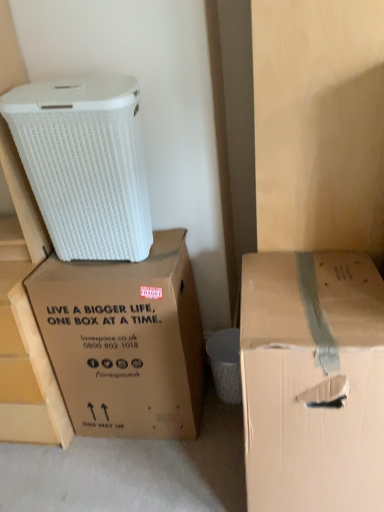
In order to click on brown cardboard box at right, the second box positioned from the left in this screenshot , I will do `click(312, 381)`.

Find the location of a particular element. The width and height of the screenshot is (384, 512). brown cardboard box at center, the 2th box viewed from the right is located at coordinates (125, 341).

This screenshot has width=384, height=512. I want to click on brown cardboard box at right, the second box positioned from the left, so click(312, 381).

Between brown cardboard box at center, the 1th box positioned from the left, and brown cardboard box at right, positioned as the first box in right-to-left order, which one has less height?

With less height is brown cardboard box at center, the 1th box positioned from the left.

You are a GUI agent. You are given a task and a screenshot of the screen. Output one action in this format:
    pyautogui.click(x=<x>, y=<y>)
    Task: Click on the box located underneath the brown cardboard box at center, the 1th box positioned from the left (from a real-world perspective)
    
    Given the screenshot: What is the action you would take?
    pyautogui.click(x=312, y=381)

Is brown cardboard box at right, the second box positioned from the left, at the back of brown cardboard box at center, the 2th box viewed from the right?

No, brown cardboard box at center, the 2th box viewed from the right, is not facing away from brown cardboard box at right, the second box positioned from the left.

Which is more to the right, brown cardboard box at center, the 2th box viewed from the right, or brown cardboard box at right, positioned as the first box in right-to-left order?

Positioned to the right is brown cardboard box at right, positioned as the first box in right-to-left order.

Which is behind, point (344, 471) or point (109, 136)?

The point (109, 136) is farther from the camera.

In the scene shown: Does brown cardboard box at right, positioned as the first box in right-to-left order, have a lesser height compared to white matte cardboard box at upper left?

No, brown cardboard box at right, positioned as the first box in right-to-left order, is not shorter than white matte cardboard box at upper left.

Do you think brown cardboard box at right, positioned as the first box in right-to-left order, is within white matte cardboard box at upper left, or outside of it?

brown cardboard box at right, positioned as the first box in right-to-left order, lies outside white matte cardboard box at upper left.

Is brown cardboard box at right, positioned as the first box in right-to-left order, to the left of white matte cardboard box at upper left from the viewer's perspective?

No, brown cardboard box at right, positioned as the first box in right-to-left order, is not to the left of white matte cardboard box at upper left.

Between brown cardboard box at center, the 2th box viewed from the right, and white matte cardboard box at upper left, which one has more height?

With more height is brown cardboard box at center, the 2th box viewed from the right.

Looking at this image, between brown cardboard box at center, the 2th box viewed from the right, and white matte cardboard box at upper left, which one has smaller size?

white matte cardboard box at upper left.

Is white matte cardboard box at upper left at the back of brown cardboard box at center, the 2th box viewed from the right?

No, brown cardboard box at center, the 2th box viewed from the right,'s orientation is not away from white matte cardboard box at upper left.

Is white matte cardboard box at upper left to the left of brown cardboard box at center, the 2th box viewed from the right, from the viewer's perspective?

Yes, white matte cardboard box at upper left is to the left of brown cardboard box at center, the 2th box viewed from the right.

In the scene shown: Is white matte cardboard box at upper left bigger or smaller than brown cardboard box at center, the 1th box positioned from the left?

white matte cardboard box at upper left is smaller than brown cardboard box at center, the 1th box positioned from the left.

Which is behind, point (118, 240) or point (121, 302)?

The point (118, 240) is farther from the camera.

Which of these two, white matte cardboard box at upper left or brown cardboard box at right, positioned as the first box in right-to-left order, is thinner?

white matte cardboard box at upper left is thinner.

Considering the sizes of white matte cardboard box at upper left and brown cardboard box at right, the second box positioned from the left, in the image, is white matte cardboard box at upper left taller or shorter than brown cardboard box at right, the second box positioned from the left,?

In the image, white matte cardboard box at upper left appears to be shorter than brown cardboard box at right, the second box positioned from the left.

Based on their positions, is white matte cardboard box at upper left located to the left or right of brown cardboard box at right, the second box positioned from the left?

From the image, it's evident that white matte cardboard box at upper left is to the left of brown cardboard box at right, the second box positioned from the left.

Which is nearer, (x=101, y=255) or (x=334, y=508)?

The point (x=334, y=508) is closer to the camera.

Is brown cardboard box at right, the second box positioned from the left, facing towards brown cardboard box at center, the 1th box positioned from the left?

No, brown cardboard box at right, the second box positioned from the left, is not facing towards brown cardboard box at center, the 1th box positioned from the left.

Which of these two, brown cardboard box at right, positioned as the first box in right-to-left order, or brown cardboard box at center, the 1th box positioned from the left, is bigger?

brown cardboard box at right, positioned as the first box in right-to-left order, is bigger.

Is brown cardboard box at right, positioned as the first box in right-to-left order, taller than brown cardboard box at center, the 2th box viewed from the right?

Correct, brown cardboard box at right, positioned as the first box in right-to-left order, is much taller as brown cardboard box at center, the 2th box viewed from the right.

Consider the image. Measure the distance between brown cardboard box at right, the second box positioned from the left, and brown cardboard box at center, the 2th box viewed from the right.

22.05 inches.

The image size is (384, 512). In the image, there is a brown cardboard box at right, the second box positioned from the left. In order to click on box above it (from the image's perspective) in this screenshot , I will do `click(125, 341)`.

You are a GUI agent. You are given a task and a screenshot of the screen. Output one action in this format:
    pyautogui.click(x=<x>, y=<y>)
    Task: Click on the cardboard box behind the brown cardboard box at right, the second box positioned from the left
    Image resolution: width=384 pixels, height=512 pixels.
    Given the screenshot: What is the action you would take?
    pyautogui.click(x=85, y=164)

Which object lies further to the anchor point white matte cardboard box at upper left, brown cardboard box at right, the second box positioned from the left, or brown cardboard box at center, the 1th box positioned from the left?

Among the two, brown cardboard box at right, the second box positioned from the left, is located further to white matte cardboard box at upper left.

When comparing their distances from brown cardboard box at right, positioned as the first box in right-to-left order, does white matte cardboard box at upper left or brown cardboard box at center, the 1th box positioned from the left, seem further?

white matte cardboard box at upper left is further to brown cardboard box at right, positioned as the first box in right-to-left order.

From the image, which object appears to be nearer to white matte cardboard box at upper left, brown cardboard box at center, the 2th box viewed from the right, or brown cardboard box at right, the second box positioned from the left?

brown cardboard box at center, the 2th box viewed from the right.

When comparing their distances from brown cardboard box at right, positioned as the first box in right-to-left order, does brown cardboard box at center, the 1th box positioned from the left, or white matte cardboard box at upper left seem further?

white matte cardboard box at upper left.

Looking at this image, based on their spatial positions, is brown cardboard box at right, positioned as the first box in right-to-left order, or white matte cardboard box at upper left further from brown cardboard box at center, the 2th box viewed from the right?

The object further to brown cardboard box at center, the 2th box viewed from the right, is brown cardboard box at right, positioned as the first box in right-to-left order.

Estimate the real-world distances between objects in this image. Which object is closer to brown cardboard box at center, the 1th box positioned from the left, white matte cardboard box at upper left or brown cardboard box at right, the second box positioned from the left?

Result: white matte cardboard box at upper left is positioned closer to the anchor brown cardboard box at center, the 1th box positioned from the left.

Locate an element on the screen. box between white matte cardboard box at upper left and brown cardboard box at right, the second box positioned from the left is located at coordinates (125, 341).